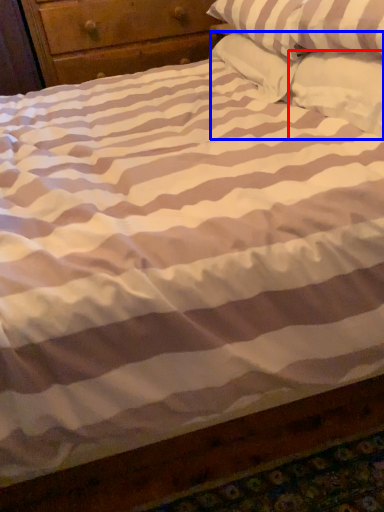
Question: Which point is further to the camera, pillow (highlighted by a red box) or pillow (highlighted by a blue box)?

Choices:
 (A) pillow
 (B) pillow

Answer: (B)